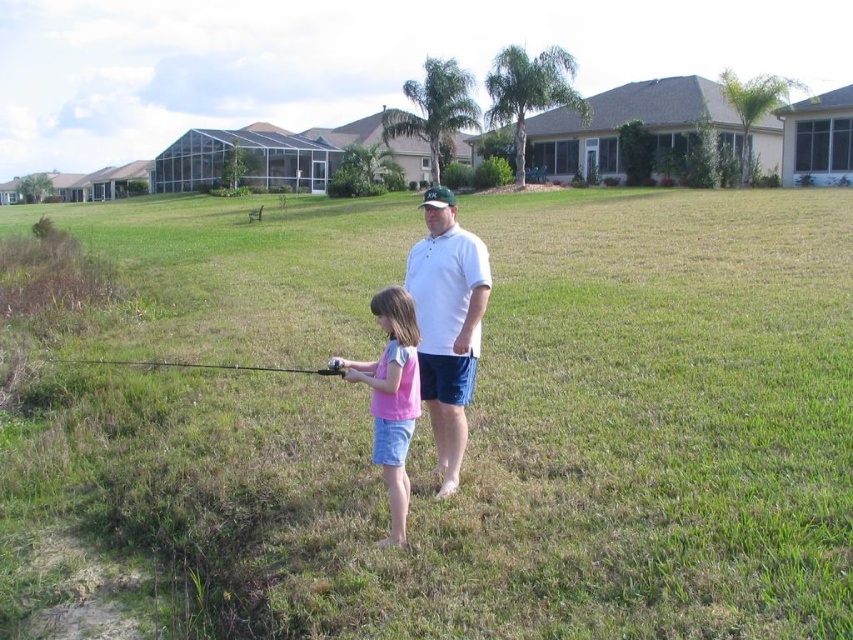
You are a fashion designer analyzing the image. You need to determine which item is smaller between the white cotton shirt at center and the black matte fishing pole at lower center. Which one is smaller?

The white cotton shirt at center is smaller than the black matte fishing pole at lower center according to the description.

You are a photographer planning to take a photo of the green grassy field at center and the white cotton shirt at center. Which object will appear taller in the photo?

The green grassy field at center will appear taller in the photo since it has a greater height compared to the white cotton shirt at center.